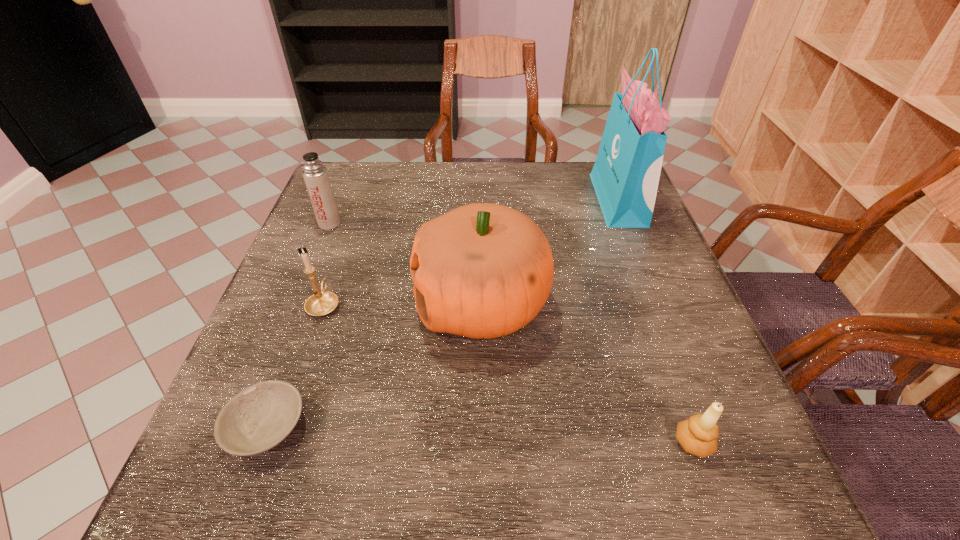
The image size is (960, 540). In order to click on the tallest object in this screenshot , I will do `click(625, 176)`.

Where is `pumpkin`? The width and height of the screenshot is (960, 540). pumpkin is located at coordinates (483, 270).

Where is `the second tallest object`? The width and height of the screenshot is (960, 540). the second tallest object is located at coordinates (483, 270).

Where is `the third tallest object`? This screenshot has width=960, height=540. the third tallest object is located at coordinates (315, 174).

The height and width of the screenshot is (540, 960). Find the location of `the taller candle_holder`. the taller candle_holder is located at coordinates (323, 302).

Locate an element on the screen. the left candle_holder is located at coordinates (323, 302).

Where is `the shorter candle_holder`? The height and width of the screenshot is (540, 960). the shorter candle_holder is located at coordinates (698, 435).

Find the location of a particular element. The width and height of the screenshot is (960, 540). the nearer candle_holder is located at coordinates (698, 435).

At what (x,y) coordinates should I click in order to perform the action: click on bowl. Please return your answer as a coordinate pair (x, y). This screenshot has height=540, width=960. Looking at the image, I should click on (257, 419).

In order to click on free spot located 0.240m on the left of the shopping bag in this screenshot , I will do `click(510, 200)`.